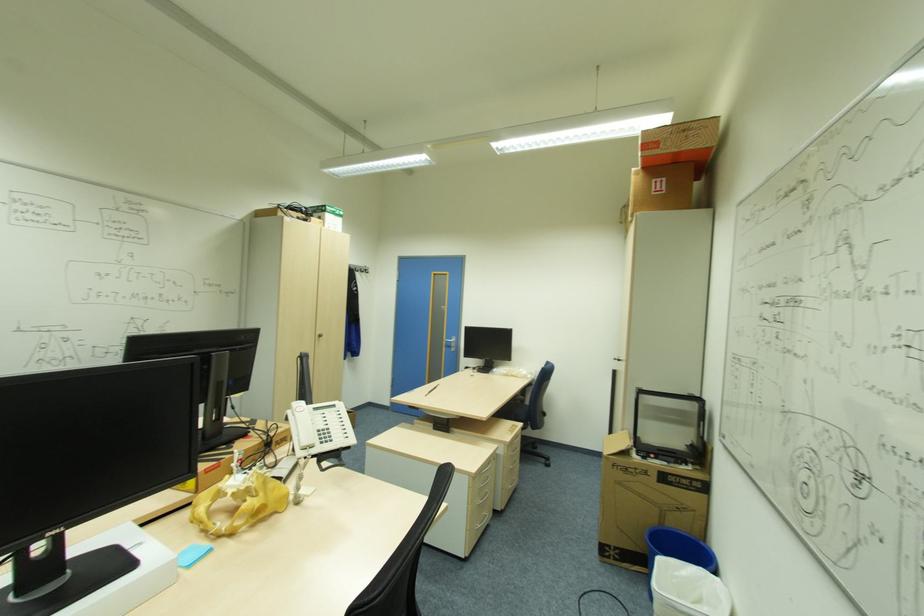
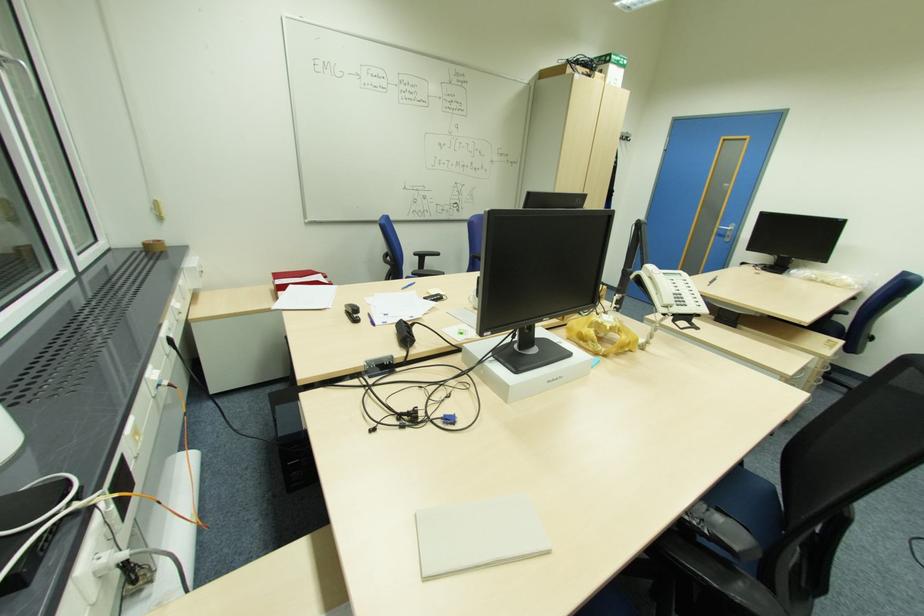
Where in the second image is the point corresponding to point (324, 442) from the first image?

(681, 305)